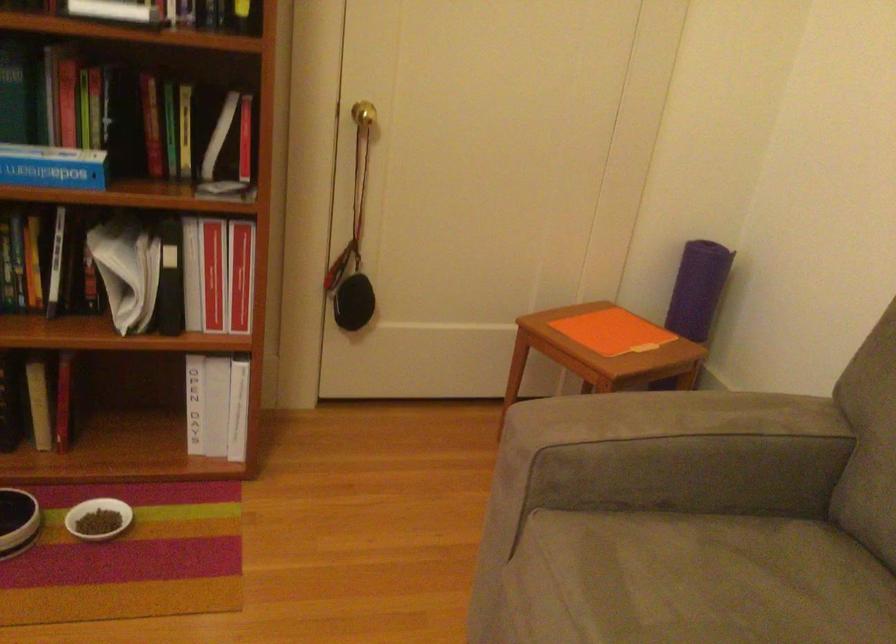
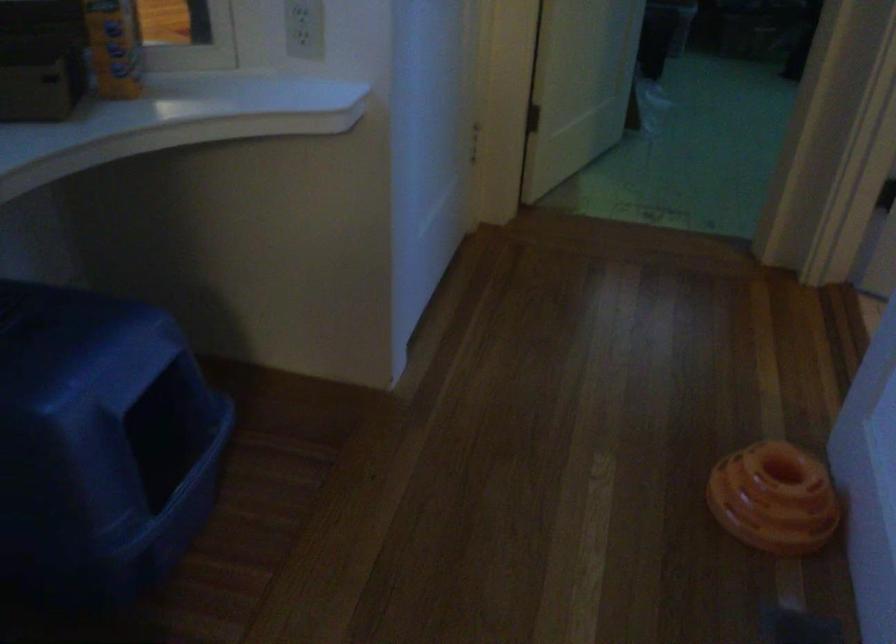
In a continuous first-person perspective shot, in which direction is the camera moving?

The movement direction of the cameraman is left, forward.